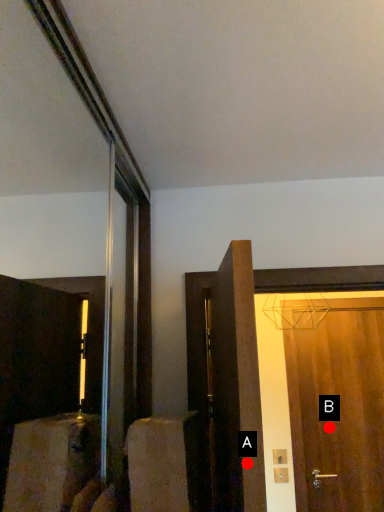
Question: Two points are circled on the image, labeled by A and B beside each circle. Among these points, which one is nearest to the camera?

Choices:
 (A) A is closer
 (B) B is closer

Answer: (A)